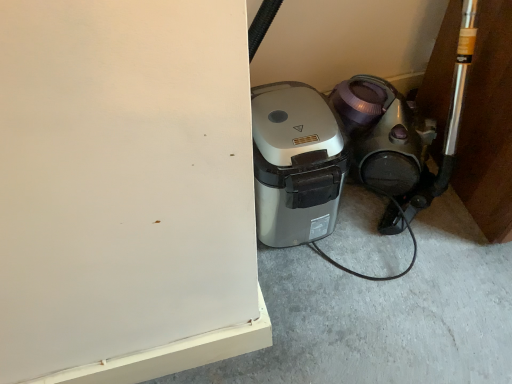
Describe the element at coordinates (384, 315) in the screenshot. This screenshot has height=384, width=512. I see `silver metallic trash can at center` at that location.

The height and width of the screenshot is (384, 512). Find the location of `silver metallic trash can at center`. silver metallic trash can at center is located at coordinates (384, 315).

What is the approximate height of silver metallic trash can at center?

silver metallic trash can at center is 1.18 inches tall.

Locate an element on the screen. The image size is (512, 384). silver metallic trash can at center is located at coordinates (384, 315).